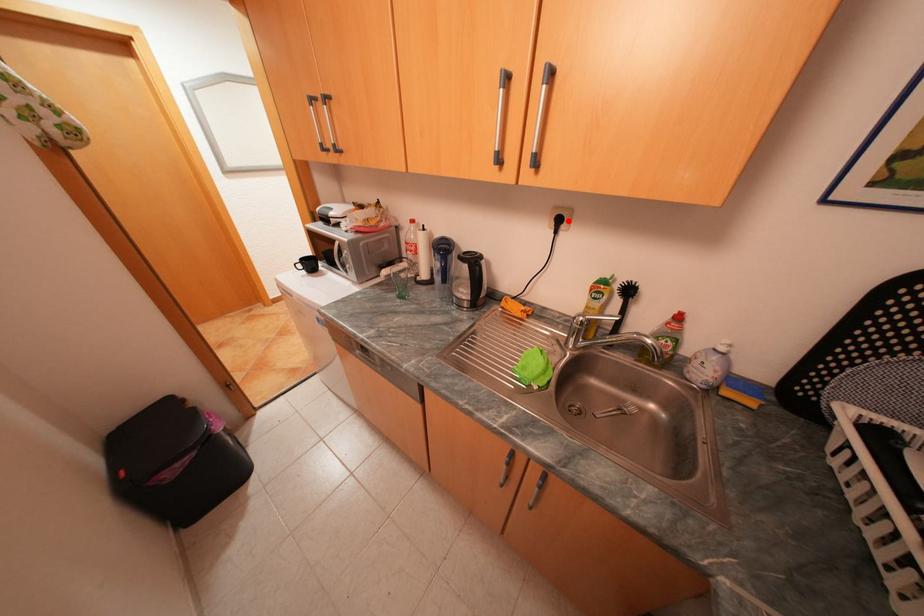
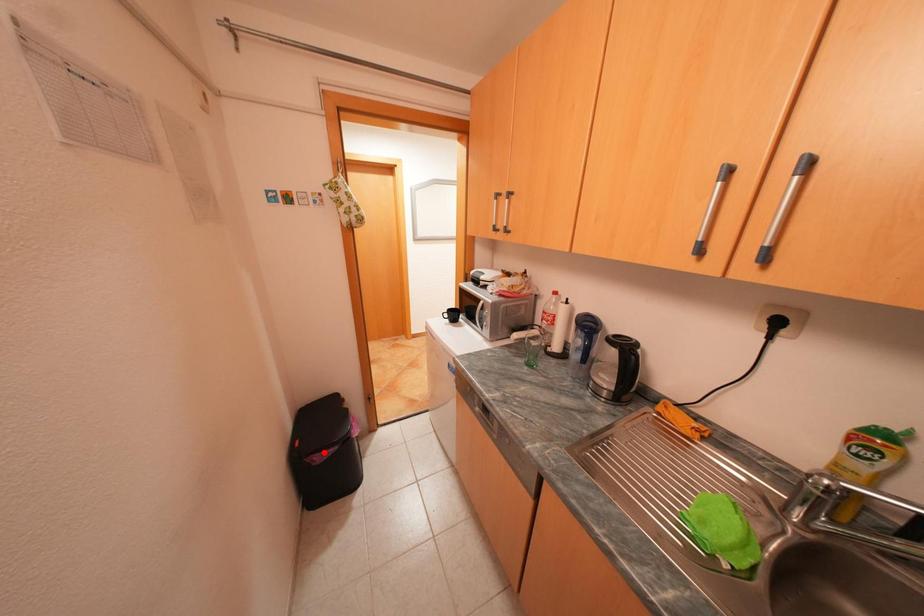
I am providing you with two images of the same scene from different viewpoints. A red point is marked on the first image and another point is marked on the second image. Is the red point in image1 aligned with the point shown in image2?

No